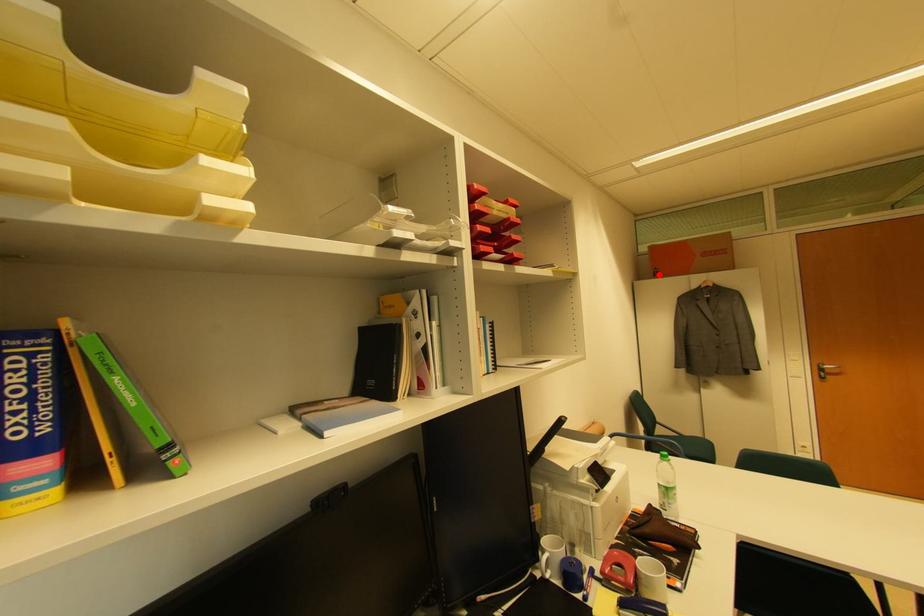
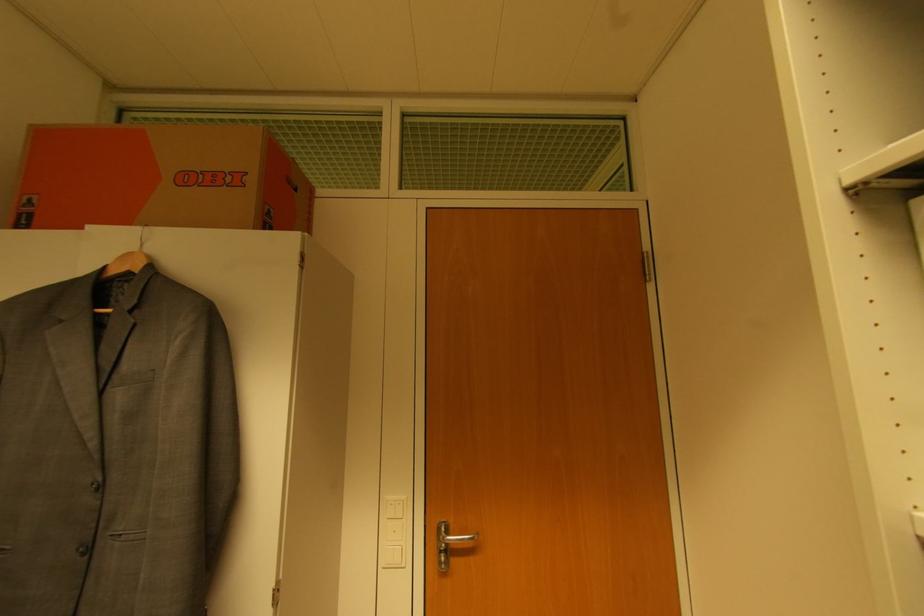
Find the pixel in the second image that matches the highlighted location in the first image.

(32, 217)